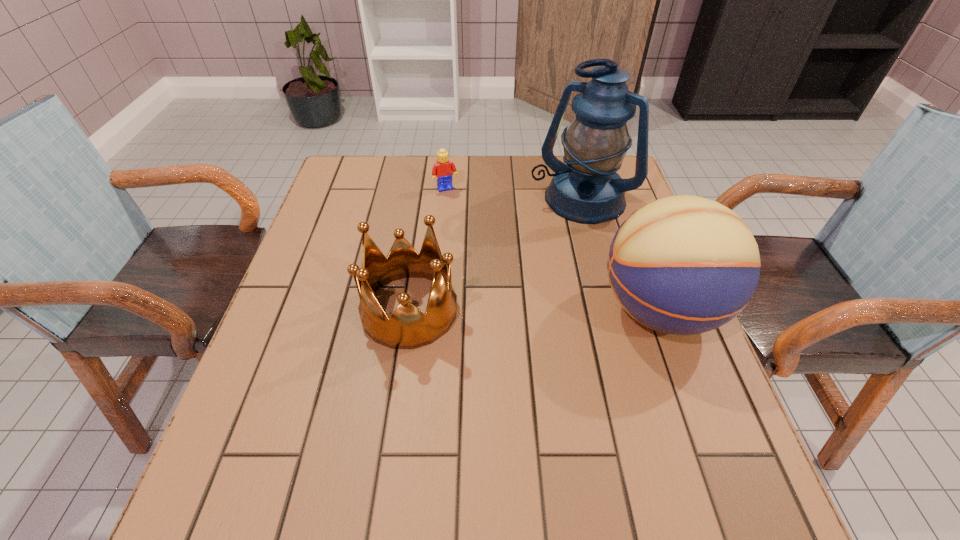
Locate an element on the screen. vacant spot on the desktop that is between the third tallest object and the basketball and is positioned on the face of the lantern is located at coordinates (503, 310).

This screenshot has width=960, height=540. Find the location of `free spot on the desktop that is between the second shortest object and the third shortest object and is positioned on the front-facing side of the Lego`. free spot on the desktop that is between the second shortest object and the third shortest object and is positioned on the front-facing side of the Lego is located at coordinates (505, 310).